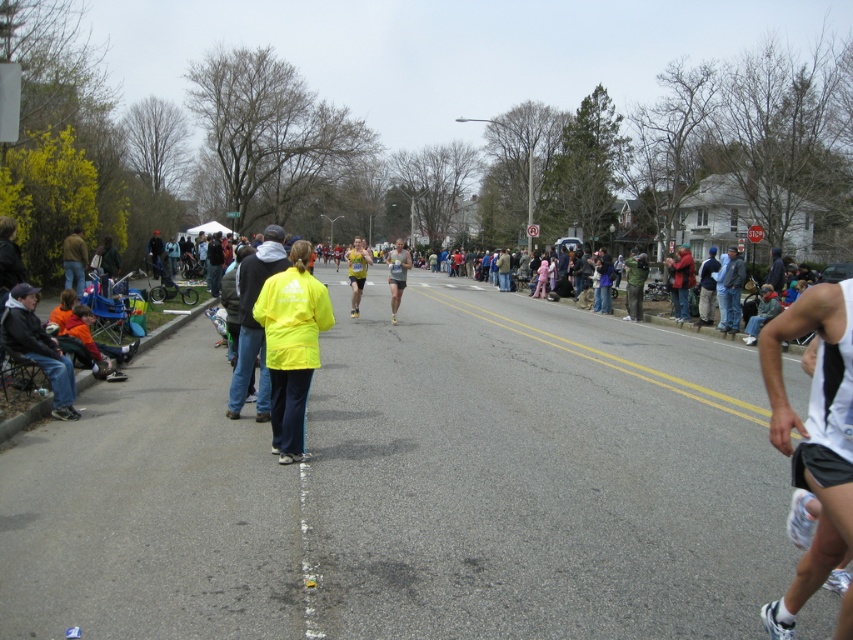
You are a photographer at the marathon event and want to capture both the denim jacket at center and the matte yellow jacket at center in a single shot. Which jacket should you focus on first to ensure both are in frame?

The denim jacket at center has a lesser height compared to the matte yellow jacket at center, so you should focus on the matte yellow jacket at center first to ensure both are in frame.

You are a photographer positioned at the starting line of the marathon. You want to capture a photo of the yellow fabric jacket at center. Considering the distance, will you need a telephoto lens to get a clear closeup shot?

The yellow fabric jacket at center is 59.20 feet away from the viewer. A telephoto lens is necessary to capture a clear closeup shot from that distance.

You are a photographer at the marathon event and want to capture a photo of both the yellow matte jacket at center and the dark blue denim jacket at lower left without any obstructions. Based on their positions, which jacket should you focus on first to ensure both are visible in the frame?

The yellow matte jacket at center is in front of the dark blue denim jacket at lower left, so you should focus on the yellow matte jacket at center first to ensure it doesn not block the view of the dark blue denim jacket at lower left.